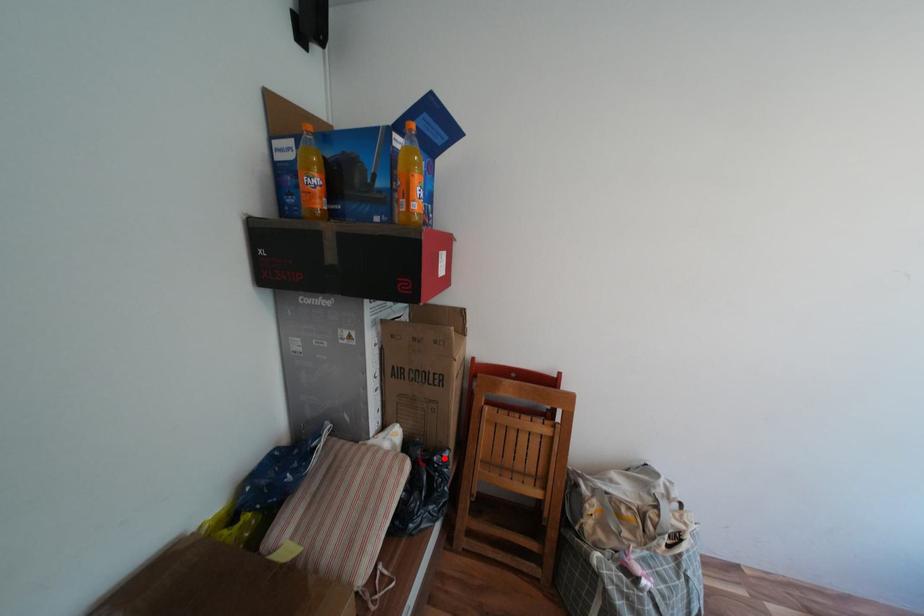
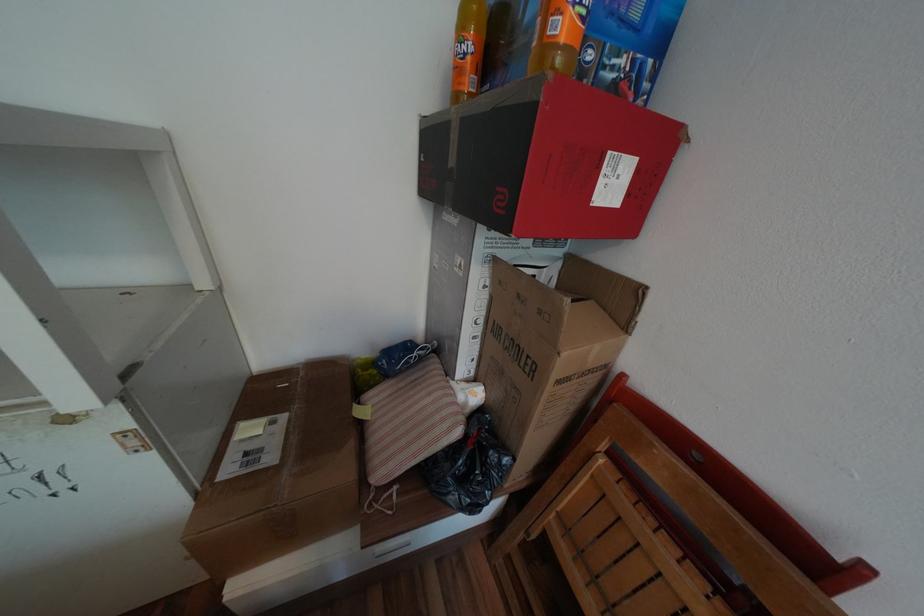
Question: A red point is marked in image1. In image2, is the corresponding 3D point closer to the camera or farther? Reply with the corresponding letter.

Choices:
 (A) The corresponding 3D point is closer.
 (B) The corresponding 3D point is farther.

Answer: (A)